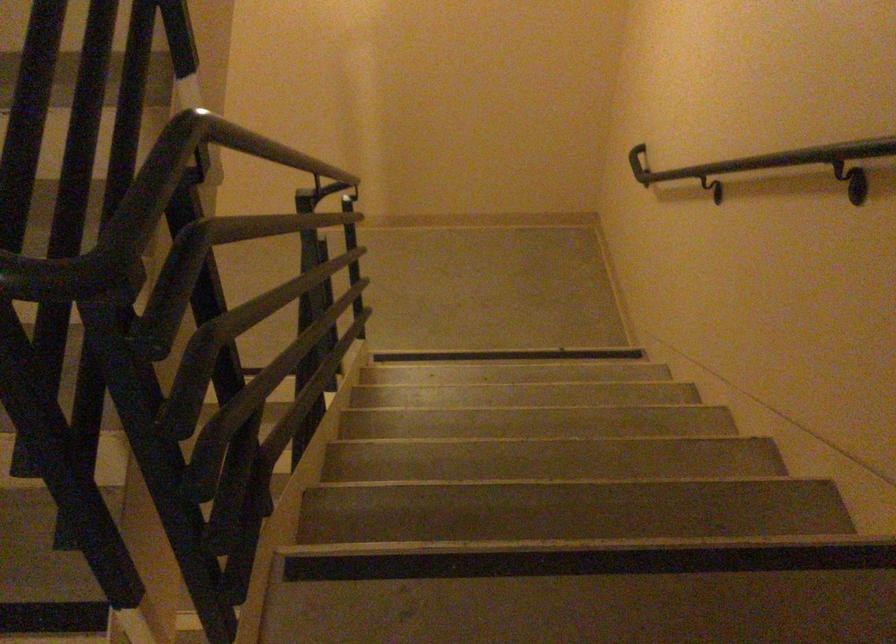
Image resolution: width=896 pixels, height=644 pixels. Identify the location of wall-mounted handrail. (764, 160).